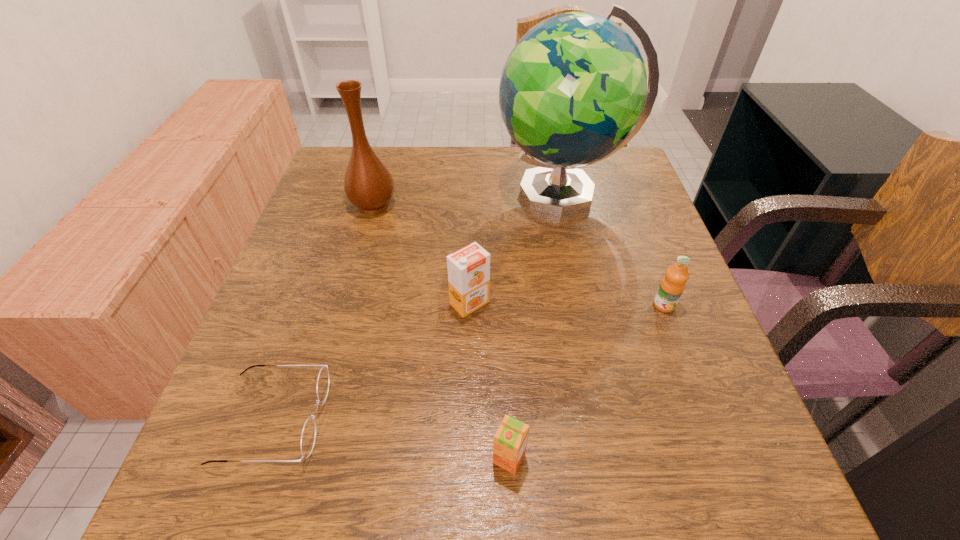
Identify the location of orange juice that is at the right edge. (672, 285).

I want to click on object at the far left corner, so click(x=368, y=184).

Where is `object positioned at the near left corner`? object positioned at the near left corner is located at coordinates (309, 432).

Where is `object situated at the far right corner`? object situated at the far right corner is located at coordinates (573, 91).

In the image, there is a desktop. Identify the location of blank space at the far edge. (423, 154).

The image size is (960, 540). Find the location of `vacant area at the near edge of the desktop`. vacant area at the near edge of the desktop is located at coordinates (398, 501).

Where is `vacant space at the left edge of the desktop`? Image resolution: width=960 pixels, height=540 pixels. vacant space at the left edge of the desktop is located at coordinates (302, 275).

You are a GUI agent. You are given a task and a screenshot of the screen. Output one action in this format:
    pyautogui.click(x=<x>, y=<y>)
    Task: Click on the vacant space at the far left corner of the desktop
    Image resolution: width=960 pixels, height=540 pixels.
    Given the screenshot: What is the action you would take?
    click(322, 177)

Locate an element on the screen. The image size is (960, 540). free space at the near left corner of the desktop is located at coordinates (289, 508).

You are a GUI agent. You are given a task and a screenshot of the screen. Output one action in this format:
    pyautogui.click(x=<x>, y=<y>)
    Task: Click on the vacant space at the far right corner
    The image size is (960, 540).
    Given the screenshot: What is the action you would take?
    pyautogui.click(x=600, y=172)